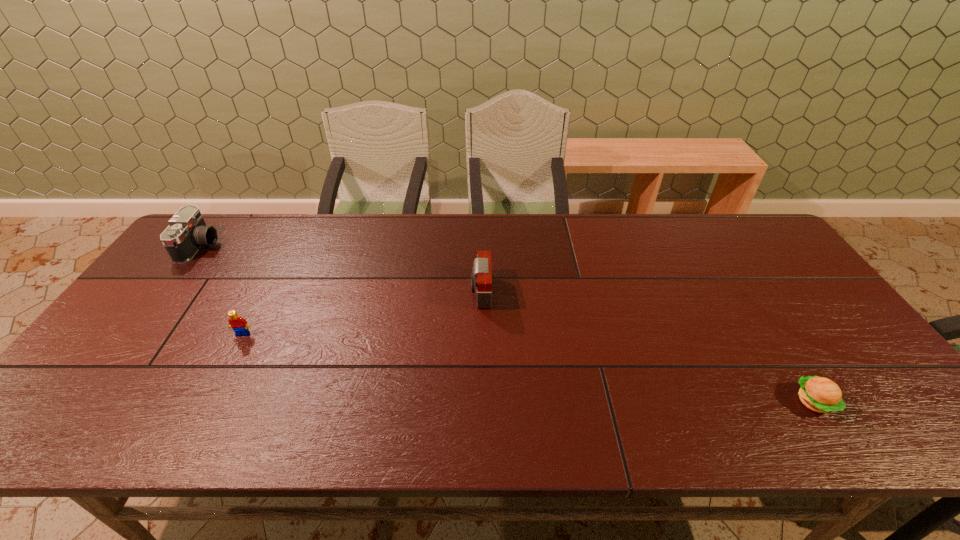
Locate an element on the screen. vacant space at the far edge is located at coordinates (651, 223).

This screenshot has height=540, width=960. I want to click on free point at the near edge, so click(525, 411).

In order to click on free space at the left edge of the desktop in this screenshot , I will do `click(111, 363)`.

Locate an element on the screen. vacant area that lies between the farther camera and the Lego is located at coordinates (222, 290).

The width and height of the screenshot is (960, 540). In order to click on vacant area between the farthest object and the second nearest object in this screenshot , I will do `click(222, 290)`.

Locate an element on the screen. Image resolution: width=960 pixels, height=540 pixels. free space between the hamburger and the farthest object is located at coordinates (507, 324).

I want to click on free space between the hamburger and the second object from left to right, so click(x=528, y=368).

Find the location of a particular element. This screenshot has height=540, width=960. free space between the right camera and the hamburger is located at coordinates (647, 347).

Image resolution: width=960 pixels, height=540 pixels. Find the location of `vacant area that lies between the second shortest object and the farther camera`. vacant area that lies between the second shortest object and the farther camera is located at coordinates pos(222,290).

Find the location of `free space between the rightmost object and the farthest object`. free space between the rightmost object and the farthest object is located at coordinates click(x=507, y=324).